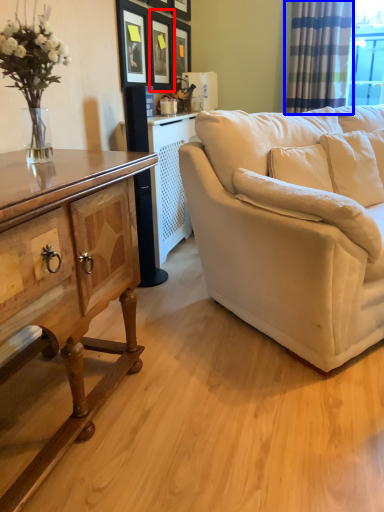
Question: Which point is further to the camera, picture frame (highlighted by a red box) or curtain (highlighted by a blue box)?

Choices:
 (A) picture frame
 (B) curtain

Answer: (B)